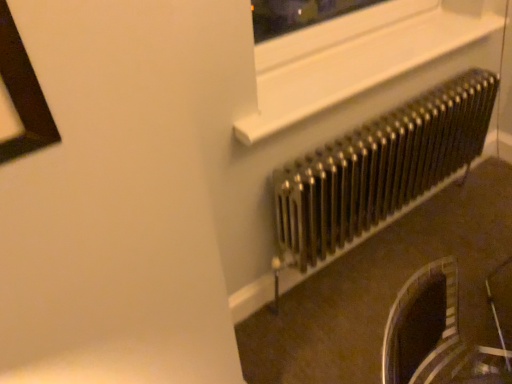
This screenshot has height=384, width=512. What do you see at coordinates (380, 167) in the screenshot? I see `metallic radiator at right` at bounding box center [380, 167].

What is the approximate width of metallic radiator at right?

The width of metallic radiator at right is 7.45 inches.

Where is `metallic radiator at right`? The width and height of the screenshot is (512, 384). metallic radiator at right is located at coordinates (380, 167).

The image size is (512, 384). I want to click on white plastic window frame at upper center, so click(x=356, y=57).

This screenshot has height=384, width=512. Describe the element at coordinates (356, 57) in the screenshot. I see `white plastic window frame at upper center` at that location.

You are a GUI agent. You are given a task and a screenshot of the screen. Output one action in this format:
    pyautogui.click(x=<x>, y=<y>)
    Task: Click on the metallic radiator at right
    The height and width of the screenshot is (384, 512).
    Given the screenshot: What is the action you would take?
    tap(380, 167)

Does white plastic window frame at upper center appear on the right side of metallic radiator at right?

Incorrect, white plastic window frame at upper center is not on the right side of metallic radiator at right.

Is white plastic window frame at upper center further to the viewer compared to metallic radiator at right?

No, the depth of white plastic window frame at upper center is less than that of metallic radiator at right.

Considering the points (396, 52) and (335, 248), which point is behind, point (396, 52) or point (335, 248)?

Positioned behind is point (335, 248).

From the image's perspective, which one is positioned lower, white plastic window frame at upper center or metallic radiator at right?

metallic radiator at right is shown below in the image.

Consider the image. From a real-world perspective, is white plastic window frame at upper center on top of metallic radiator at right?

Correct, in the physical world, white plastic window frame at upper center is higher than metallic radiator at right.

Which object is thinner, white plastic window frame at upper center or metallic radiator at right?

metallic radiator at right is thinner.

Who is shorter, white plastic window frame at upper center or metallic radiator at right?

white plastic window frame at upper center.

Considering the sizes of objects white plastic window frame at upper center and metallic radiator at right in the image provided, who is smaller, white plastic window frame at upper center or metallic radiator at right?

With smaller size is white plastic window frame at upper center.

Is white plastic window frame at upper center not inside metallic radiator at right?

white plastic window frame at upper center lies outside metallic radiator at right's area.

Is white plastic window frame at upper center next to metallic radiator at right and touching it?

No.

In the scene shown: Is white plastic window frame at upper center turned away from metallic radiator at right?

white plastic window frame at upper center does not have its back to metallic radiator at right.

Locate an element on the screen. The width and height of the screenshot is (512, 384). window frame on the left side of metallic radiator at right is located at coordinates click(x=356, y=57).

Which is more to the left, metallic radiator at right or white plastic window frame at upper center?

From the viewer's perspective, white plastic window frame at upper center appears more on the left side.

Does metallic radiator at right lie in front of white plastic window frame at upper center?

No.

Which is closer, (332, 199) or (279, 39)?

Positioned in front is point (279, 39).

From the image's perspective, between metallic radiator at right and white plastic window frame at upper center, which one is located above?

white plastic window frame at upper center is shown above in the image.

From a real-world perspective, who is located higher, metallic radiator at right or white plastic window frame at upper center?

white plastic window frame at upper center, from a real-world perspective.

From the picture: Which of these two, metallic radiator at right or white plastic window frame at upper center, is wider?

Wider between the two is white plastic window frame at upper center.

From the picture: In terms of height, does metallic radiator at right look taller or shorter compared to white plastic window frame at upper center?

Clearly, metallic radiator at right is taller compared to white plastic window frame at upper center.

Is metallic radiator at right smaller than white plastic window frame at upper center?

Incorrect, metallic radiator at right is not smaller in size than white plastic window frame at upper center.

Consider the image. Would you say white plastic window frame at upper center is part of metallic radiator at right's contents?

No, white plastic window frame at upper center is not a part of metallic radiator at right.

Is metallic radiator at right far from white plastic window frame at upper center?

No.

Is metallic radiator at right oriented away from white plastic window frame at upper center?

metallic radiator at right does not have its back to white plastic window frame at upper center.

How many degrees apart are the facing directions of metallic radiator at right and white plastic window frame at upper center?

1.8 degrees separate the facing orientations of metallic radiator at right and white plastic window frame at upper center.

How distant is metallic radiator at right from white plastic window frame at upper center?

metallic radiator at right is 12.37 inches from white plastic window frame at upper center.

Where is `window frame above the metallic radiator at right (from a real-world perspective)`? The height and width of the screenshot is (384, 512). window frame above the metallic radiator at right (from a real-world perspective) is located at coordinates (356, 57).

What are the coordinates of `window frame positioned vertically above the metallic radiator at right (from a real-world perspective)` in the screenshot? It's located at (356, 57).

Locate an element on the screen. This screenshot has height=384, width=512. window frame in front of the metallic radiator at right is located at coordinates (356, 57).